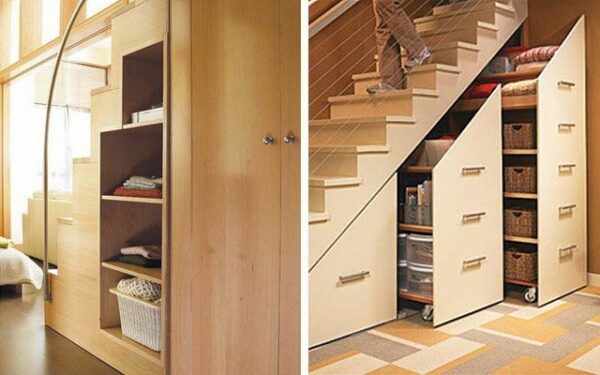
What are the coordinates of `wall` in the screenshot? It's located at (593, 164).